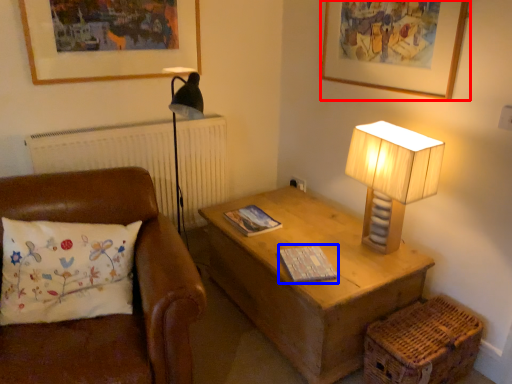
Question: Which point is further to the camera, picture frame (highlighted by a red box) or magazine (highlighted by a blue box)?

Choices:
 (A) picture frame
 (B) magazine

Answer: (B)